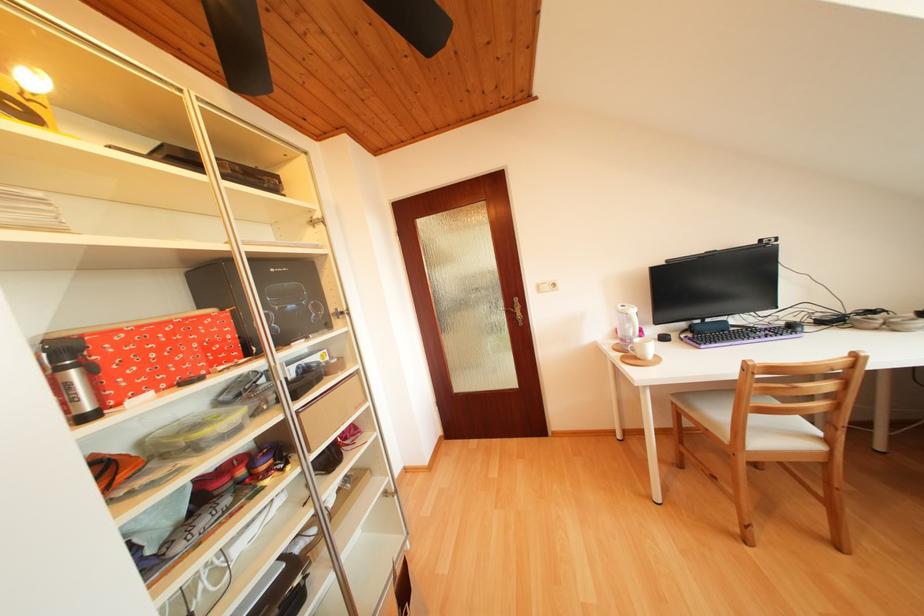
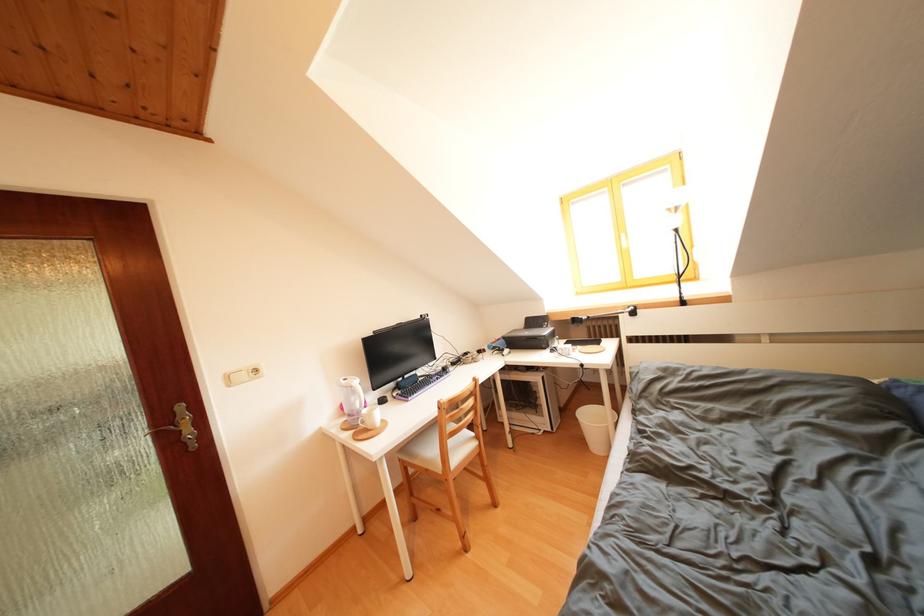
Question: The camera is either moving clockwise (left) or counter-clockwise (right) around the object. The first image is from the beginning of the video and the second image is from the end. Is the camera moving left or right when shooting the video?

Choices:
 (A) Left
 (B) Right

Answer: (A)